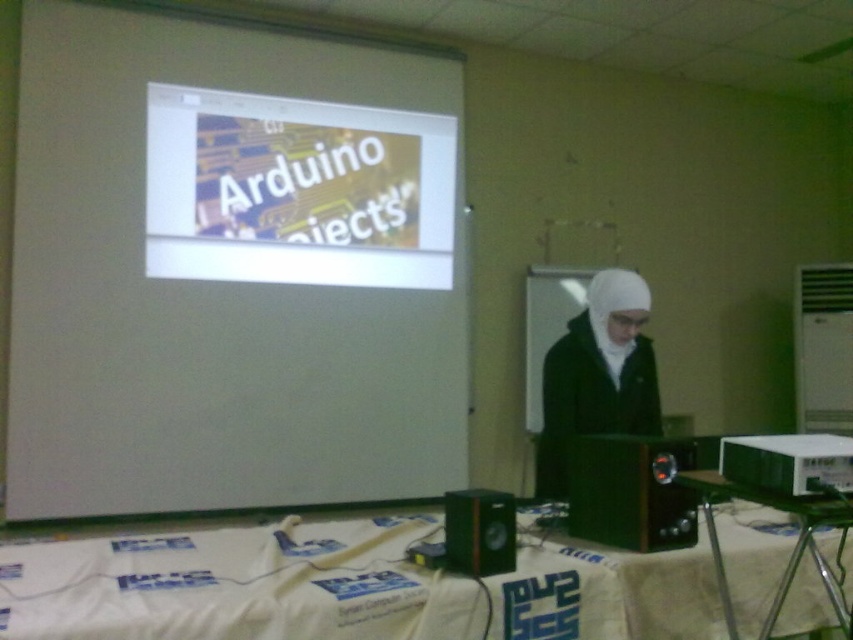
Based on the photo, you are setting up for a presentation and need to place a laptop between the green plastic table at lower right and the white plastic projector at lower right. Can the laptop fit vertically between them?

The green plastic table at lower right is taller than the white plastic projector at lower right, so placing a laptop vertically between them would not be possible since the table is taller and the projector is shorter.

You are an event organizer setting up for a tech conference. You have to place a large banner that needs to be visible to all attendees. Given the white matte projector screen at upper center and the metallic black speaker at lower right, which object should the banner be placed in front of to ensure it doesn

The banner should be placed in front of the white matte projector screen at upper center because it is larger than the metallic black speaker at lower right, providing a better backdrop for visibility.